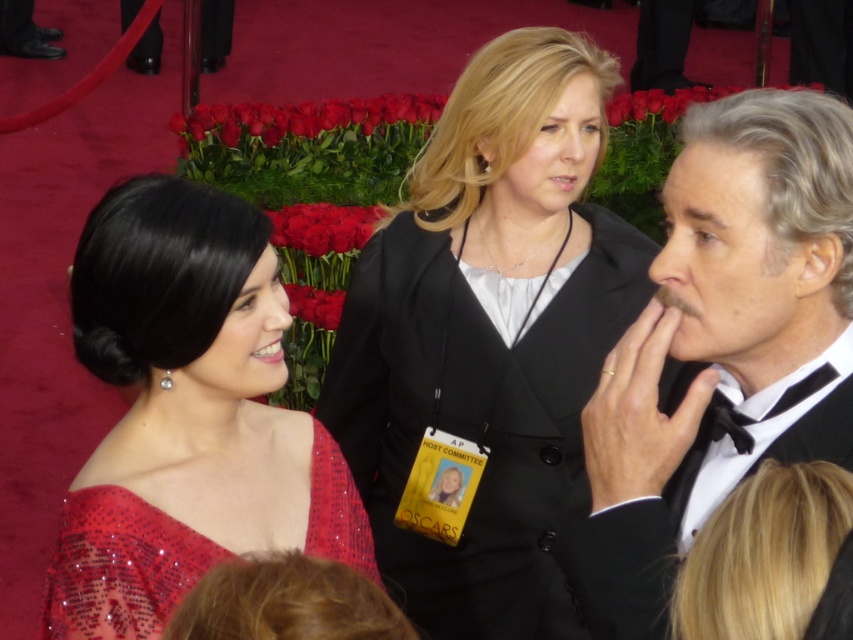
Who is higher up, black matte suit at center or blonde hair at center?

Positioned higher is black matte suit at center.

Between black matte suit at center and blonde hair at center, which one appears on the right side from the viewer's perspective?

From the viewer's perspective, blonde hair at center appears more on the right side.

The height and width of the screenshot is (640, 853). I want to click on black matte suit at center, so click(x=486, y=342).

Image resolution: width=853 pixels, height=640 pixels. What are the coordinates of `black matte suit at center` in the screenshot? It's located at [x=486, y=342].

Between black matte suit at center and shiny sequined dress at center, which one has less height?

With less height is shiny sequined dress at center.

In order to click on black matte suit at center in this screenshot , I will do `click(486, 342)`.

Who is higher up, shiny sequined dress at center or satin sequined dress at lower left?

Positioned higher is shiny sequined dress at center.

Does shiny sequined dress at center appear under satin sequined dress at lower left?

No, shiny sequined dress at center is not below satin sequined dress at lower left.

The width and height of the screenshot is (853, 640). Find the location of `shiny sequined dress at center`. shiny sequined dress at center is located at coordinates (186, 413).

Where is `shiny sequined dress at center`? shiny sequined dress at center is located at coordinates (186, 413).